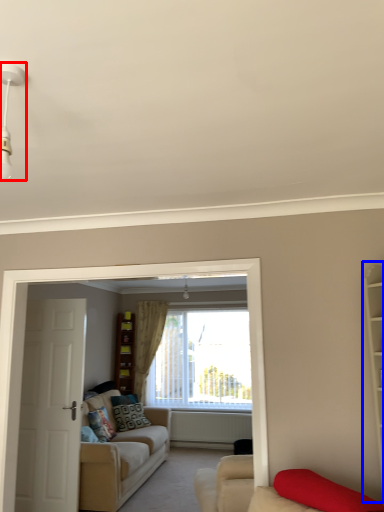
Question: Which object appears farthest to the camera in this image, light fixture (highlighted by a red box) or bookshelf (highlighted by a blue box)?

Choices:
 (A) light fixture
 (B) bookshelf

Answer: (B)